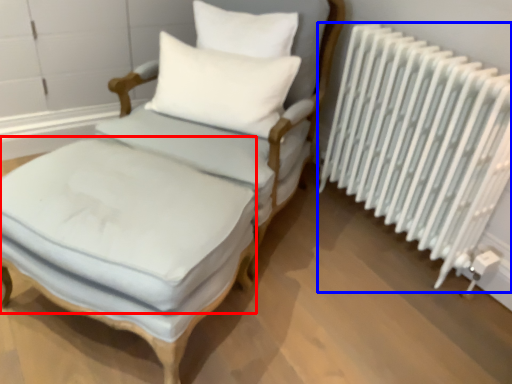
Question: Among these objects, which one is nearest to the camera, mattress (highlighted by a red box) or radiator (highlighted by a blue box)?

Choices:
 (A) mattress
 (B) radiator

Answer: (A)